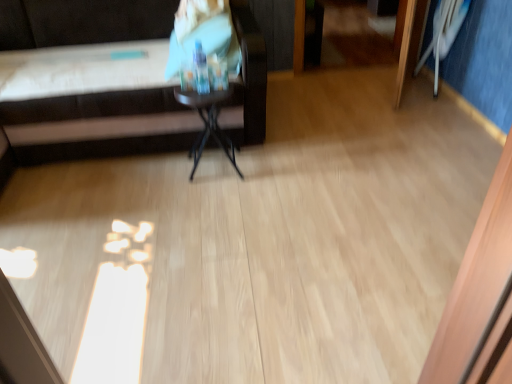
Identify the location of vacant region to the right of brown leather couch at upper left. This screenshot has height=384, width=512. (350, 144).